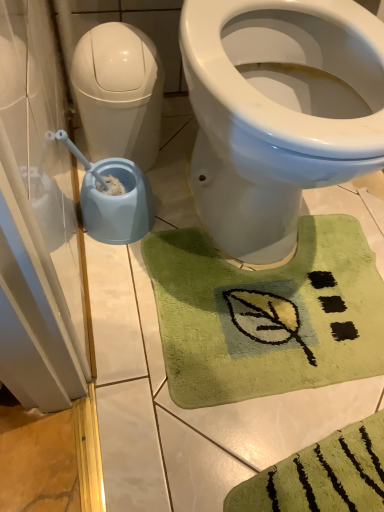
The height and width of the screenshot is (512, 384). In order to click on vacant point above green plush bath mat at lower center (from a real-world perspective) in this screenshot , I will do `click(281, 296)`.